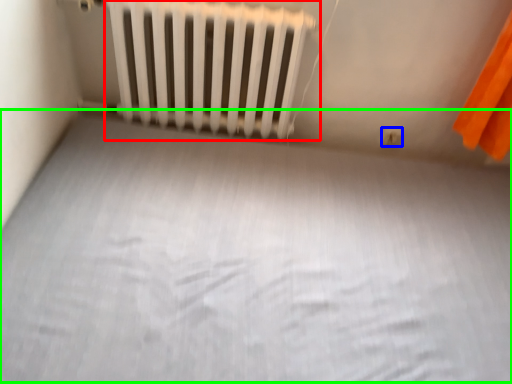
Question: Based on their relative distances, which object is nearer to radiator (highlighted by a red box)? Choose from electric outlet (highlighted by a blue box) and bed frame (highlighted by a green box).

Choices:
 (A) electric outlet
 (B) bed frame

Answer: (B)